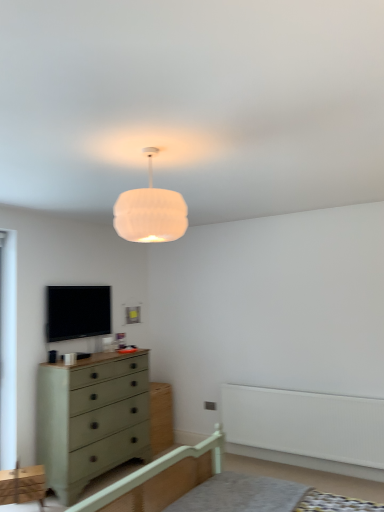
Question: Is white painted wood bed frame at center taller or shorter than white plastic balustrade at lower right?

Choices:
 (A) tall
 (B) short

Answer: (A)

Question: From the image's perspective, is white painted wood bed frame at center located above or below white plastic balustrade at lower right?

Choices:
 (A) below
 (B) above

Answer: (B)

Question: Estimate the real-world distances between objects in this image. Which object is closer to the white fabric lampshade at upper center?

Choices:
 (A) green matte cabinet at lower left
 (B) black glossy tv at upper left
 (C) white plastic balustrade at lower right
 (D) green painted wood chest of drawers at lower left
 (E) white painted wood bed frame at center

Answer: (E)

Question: Estimate the real-world distances between objects in this image. Which object is farther from the green matte cabinet at lower left?

Choices:
 (A) white plastic balustrade at lower right
 (B) white fabric lampshade at upper center
 (C) white painted wood bed frame at center
 (D) green painted wood chest of drawers at lower left
 (E) black glossy tv at upper left

Answer: (B)